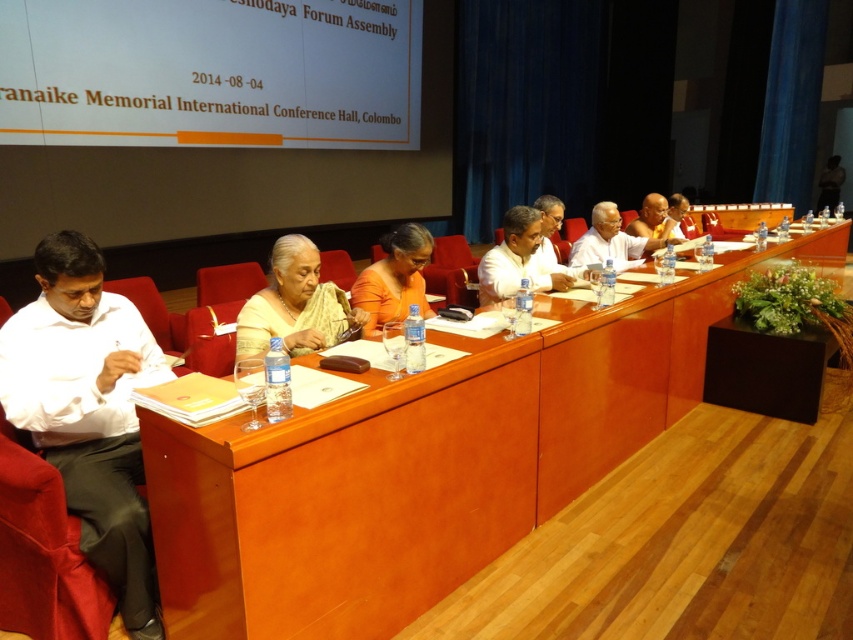
You are organizing a photo shoot and need to place a backdrop behind the white cotton shirt at left and the orange fabric saree at center. Given that the backdrop must cover both objects completely, which object requires a wider backdrop?

The white cotton shirt at left requires a wider backdrop because its width surpasses that of the orange fabric saree at center.

You are standing in the auditorium and want to place a small plant on the table at point (x=91, y=529). The plant requires at least 5 feet of clearance from the nearest audience member. Is there enough space?

The distance of point (x=91, y=529) from viewer is 6.28 feet, so yes, there is enough space as it exceeds the required 5 feet clearance.